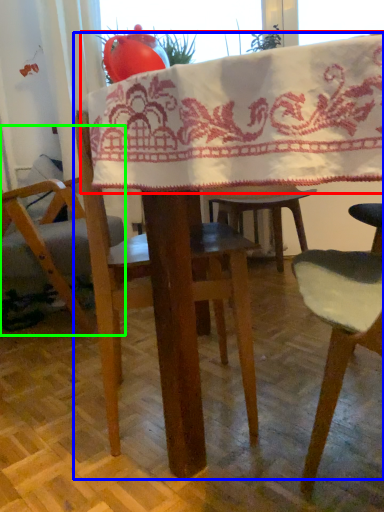
Question: Based on their relative distances, which object is farther from blanket (highlighted by a red box)? Choose from table (highlighted by a blue box) and chair (highlighted by a green box).

Choices:
 (A) table
 (B) chair

Answer: (B)